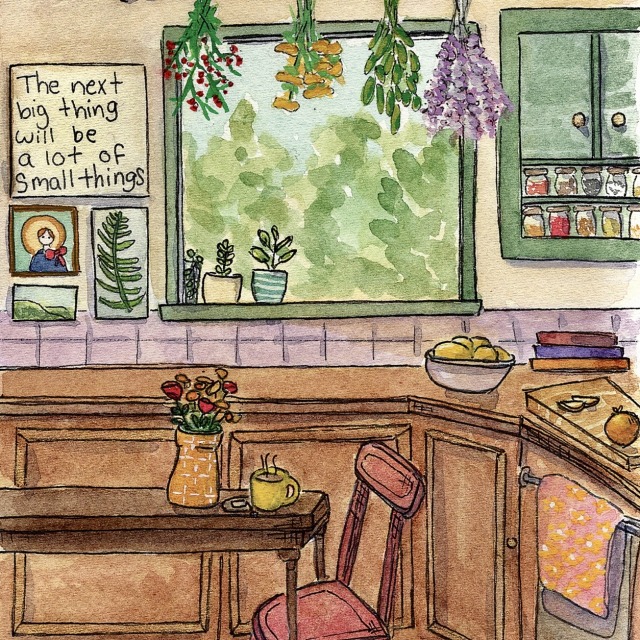
I want to click on vase, so click(201, 483).